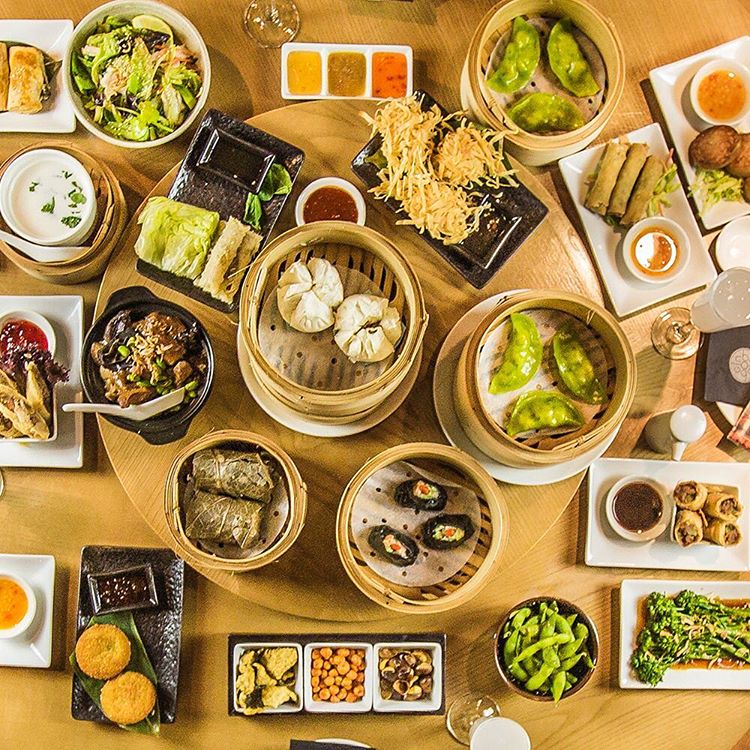
Locate an element on the screen. The height and width of the screenshot is (750, 750). glass is located at coordinates (694, 324), (274, 16), (476, 715).